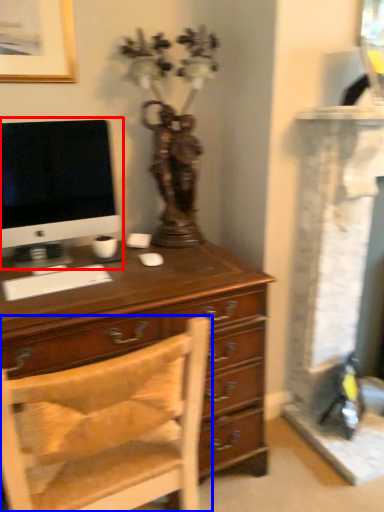
Question: Which object appears farthest to the camera in this image, computer monitor (highlighted by a red box) or chair (highlighted by a blue box)?

Choices:
 (A) computer monitor
 (B) chair

Answer: (A)